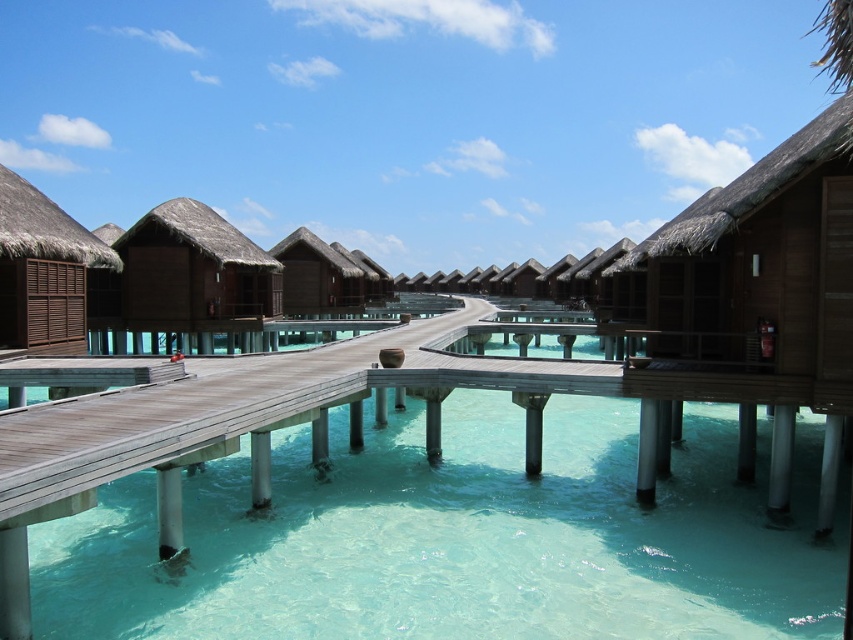
You are a guest staying at the resort and want to take a photo of the matte brown hut at center from the clear turquoise water at center. Is the water level high enough to reflect the entire hut?

The clear turquoise water at center has a lesser height compared to matte brown hut at center, so the water level is not high enough to reflect the entire hut.

Consider the image. You are a guest staying at the resort and want to walk from your bungalow to the nearest restaurant located at the end of the walkway. The walkway is narrow, and you notice the clear turquoise water at center and the brown thatched roof hut at center. Which object is wider so you can step aside if needed?

The clear turquoise water at center is wider than the brown thatched roof hut at center, so you can step aside onto the water area if needed.

You are standing on the walkway leading to the matte brown hut at center. Looking towards the clear turquoise water at center, which direction should you face to see the water before the hut?

You should face forward because the clear turquoise water at center is in front of the matte brown hut at center, so looking towards the water would show it positioned ahead of the hut.